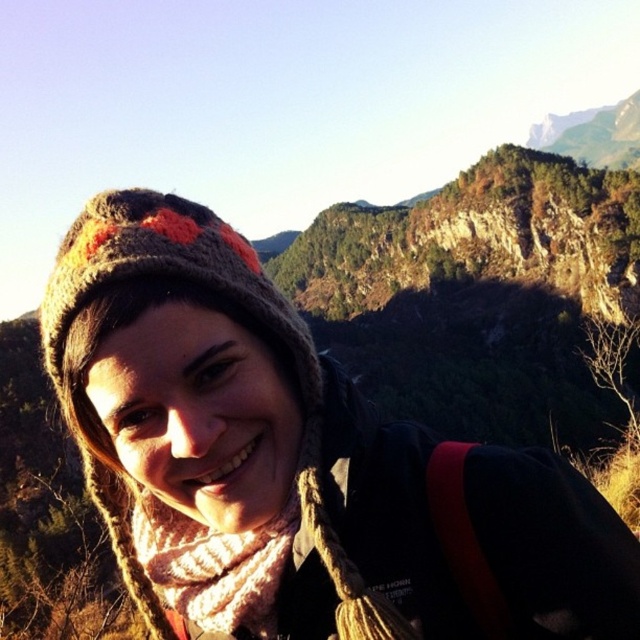
The width and height of the screenshot is (640, 640). What do you see at coordinates (164, 272) in the screenshot?
I see `knitted woolen hat at upper left` at bounding box center [164, 272].

Can you confirm if knitted woolen hat at upper left is smaller than knitted beige scarf at lower center?

No, knitted woolen hat at upper left is not smaller than knitted beige scarf at lower center.

Find the location of a particular element. knitted woolen hat at upper left is located at coordinates (164, 272).